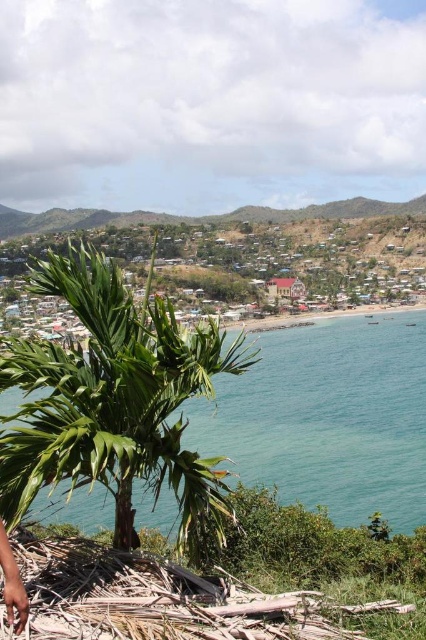
Based on the photo, which is more to the right, green water at center or green grassy hillside at upper center?

green water at center is more to the right.

Does green water at center appear on the right side of green grassy hillside at upper center?

Yes, green water at center is to the right of green grassy hillside at upper center.

Does point (305, 396) lie behind point (75, 216)?

No, (305, 396) is closer to viewer.

The width and height of the screenshot is (426, 640). In order to click on green water at center in this screenshot , I will do `click(328, 417)`.

Is green water at center smaller than green leafy palm tree at center?

Yes, green water at center is smaller than green leafy palm tree at center.

Does point (287, 403) come farther from viewer compared to point (155, 348)?

Yes, point (287, 403) is farther from viewer.

The image size is (426, 640). I want to click on green water at center, so pyautogui.click(x=328, y=417).

Which is above, green water at center or brown textured palm fronds at lower left?

Positioned higher is green water at center.

Identify the location of green water at center. (328, 417).

This screenshot has height=640, width=426. I want to click on green water at center, so click(x=328, y=417).